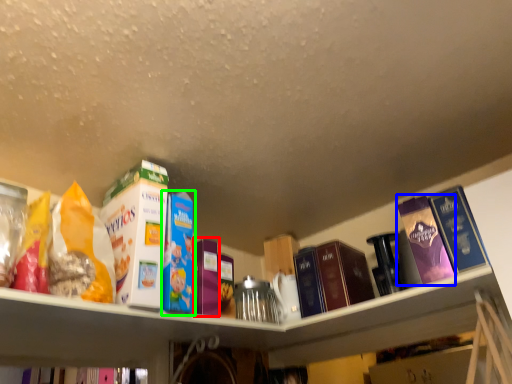
Question: Which object is the closest to the book (highlighted by a red box)? Choose among these: book (highlighted by a blue box) or book (highlighted by a green box).

Choices:
 (A) book
 (B) book

Answer: (B)